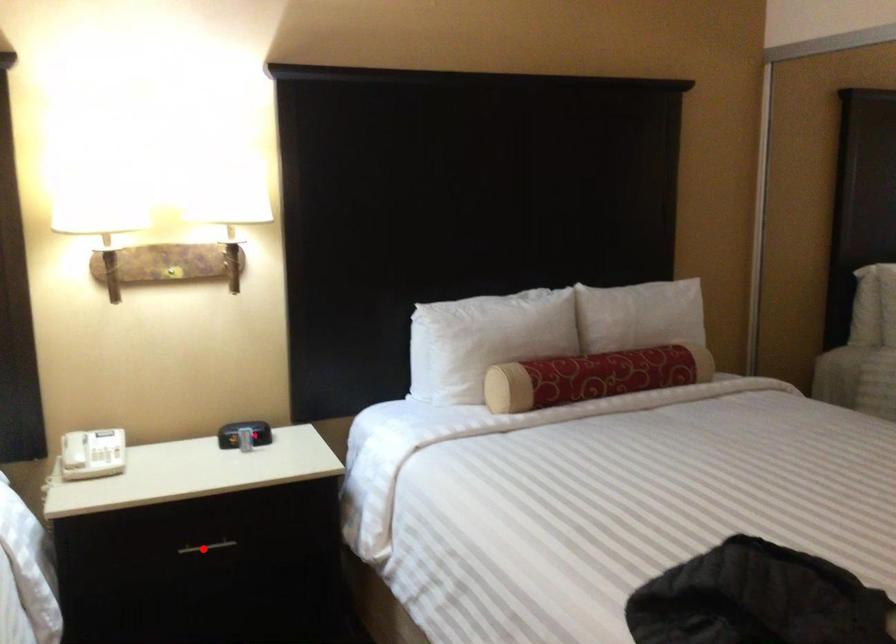
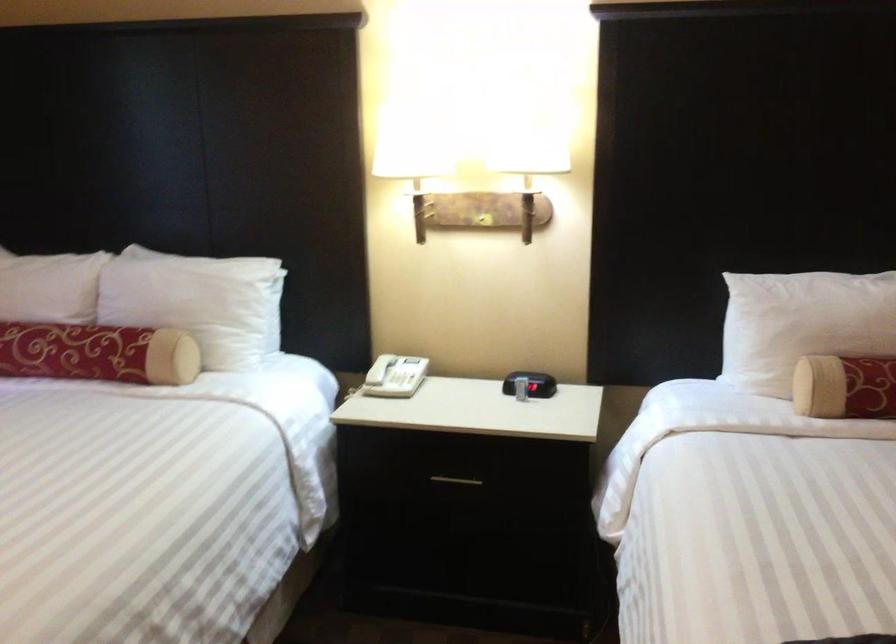
Where in the second image is the point corresponding to the highlighted location from the first image?

(455, 480)